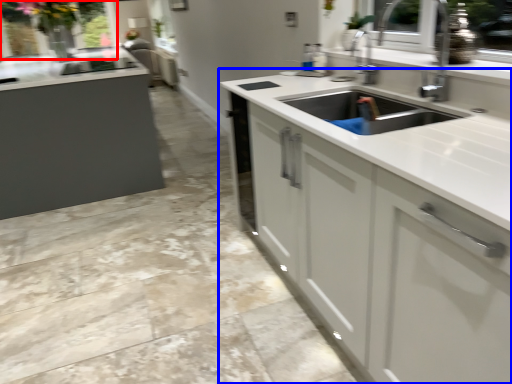
Question: Which point is closer to the camera, window screen (highlighted by a red box) or countertop (highlighted by a blue box)?

Choices:
 (A) window screen
 (B) countertop

Answer: (B)